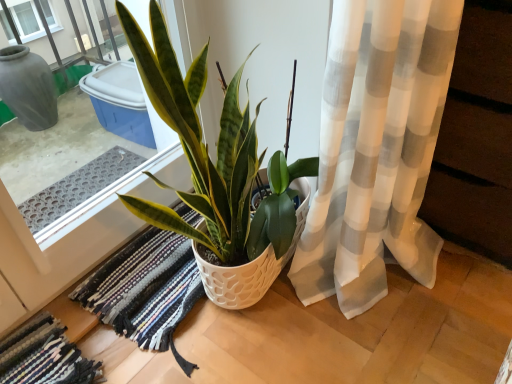
Question: Does green glossy plant at center have a greater width compared to multicolored woven rug at lower left, which is the second bath mat in right-to-left order?

Choices:
 (A) no
 (B) yes

Answer: (B)

Question: Considering the relative positions of green glossy plant at center and multicolored woven rug at lower left, which is the second bath mat in right-to-left order, in the image provided, is green glossy plant at center to the left of multicolored woven rug at lower left, which is the second bath mat in right-to-left order, from the viewer's perspective?

Choices:
 (A) yes
 (B) no

Answer: (B)

Question: Is green glossy plant at center shorter than multicolored woven rug at lower left, which ranks as the 1th bath mat in left-to-right order?

Choices:
 (A) no
 (B) yes

Answer: (A)

Question: Does green glossy plant at center lie in front of multicolored woven rug at lower left, which is the second bath mat in right-to-left order?

Choices:
 (A) yes
 (B) no

Answer: (A)

Question: Is the depth of green glossy plant at center greater than that of multicolored woven rug at lower left, which ranks as the 1th bath mat in left-to-right order?

Choices:
 (A) yes
 (B) no

Answer: (B)

Question: In terms of height, does green glossy plant at center look taller or shorter compared to multicolored woven rug at lower left, which is the second bath mat in right-to-left order?

Choices:
 (A) tall
 (B) short

Answer: (A)

Question: From the image's perspective, relative to multicolored woven rug at lower left, which is the second bath mat in right-to-left order, is green glossy plant at center above or below?

Choices:
 (A) above
 (B) below

Answer: (A)

Question: Is green glossy plant at center in front of or behind multicolored woven rug at lower left, which ranks as the 1th bath mat in left-to-right order, in the image?

Choices:
 (A) front
 (B) behind

Answer: (A)

Question: Is green glossy plant at center bigger or smaller than multicolored woven rug at lower left, which is the second bath mat in right-to-left order?

Choices:
 (A) big
 (B) small

Answer: (A)

Question: Considering the positions of green glossy plant at center and multicolored woven rug at center, the second bath mat from the left, in the image, is green glossy plant at center wider or thinner than multicolored woven rug at center, the second bath mat from the left,?

Choices:
 (A) wide
 (B) thin

Answer: (B)

Question: Does point (281, 264) appear closer or farther from the camera than point (136, 261)?

Choices:
 (A) closer
 (B) farther

Answer: (A)

Question: Relative to multicolored woven rug at center, the 1th bath mat from the right, is green glossy plant at center in front or behind?

Choices:
 (A) front
 (B) behind

Answer: (A)

Question: From the image's perspective, is green glossy plant at center located above or below multicolored woven rug at center, the second bath mat from the left?

Choices:
 (A) above
 (B) below

Answer: (A)

Question: From the image's perspective, is multicolored woven rug at center, the second bath mat from the left, above or below multicolored woven rug at lower left, which ranks as the 1th bath mat in left-to-right order?

Choices:
 (A) below
 (B) above

Answer: (B)

Question: In terms of width, does multicolored woven rug at center, the 1th bath mat from the right, look wider or thinner when compared to multicolored woven rug at lower left, which ranks as the 1th bath mat in left-to-right order?

Choices:
 (A) thin
 (B) wide

Answer: (B)